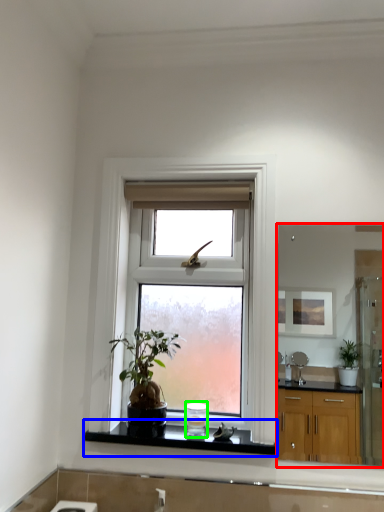
Question: Considering the real-world distances, which object is closest to mirror (highlighted by a red box)? window sill (highlighted by a blue box) or appliance (highlighted by a green box).

Choices:
 (A) window sill
 (B) appliance

Answer: (B)